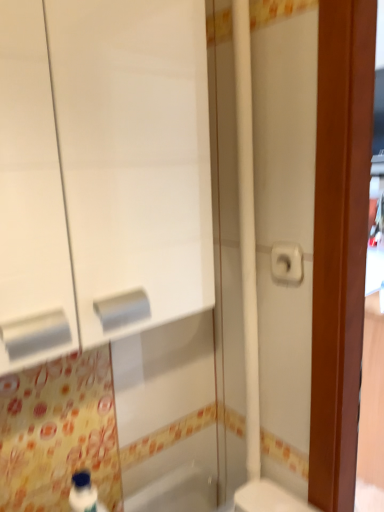
Question: Does white matte cabinet at left have a lesser width compared to white matte toilet paper at right?

Choices:
 (A) no
 (B) yes

Answer: (A)

Question: Is white matte cabinet at left surrounding white matte toilet paper at right?

Choices:
 (A) yes
 (B) no

Answer: (B)

Question: From the image's perspective, is white matte cabinet at left over white matte toilet paper at right?

Choices:
 (A) yes
 (B) no

Answer: (A)

Question: Considering the relative sizes of white matte cabinet at left and white matte toilet paper at right in the image provided, is white matte cabinet at left bigger than white matte toilet paper at right?

Choices:
 (A) yes
 (B) no

Answer: (A)

Question: Would you consider white matte cabinet at left to be distant from white matte toilet paper at right?

Choices:
 (A) no
 (B) yes

Answer: (A)

Question: Is white glossy toilet at lower right to the left or to the right of white matte toilet paper at right in the image?

Choices:
 (A) right
 (B) left

Answer: (A)

Question: Is white glossy toilet at lower right bigger or smaller than white matte toilet paper at right?

Choices:
 (A) small
 (B) big

Answer: (B)

Question: Considering the positions of white glossy toilet at lower right and white matte toilet paper at right in the image, is white glossy toilet at lower right taller or shorter than white matte toilet paper at right?

Choices:
 (A) short
 (B) tall

Answer: (B)

Question: In terms of width, does white glossy toilet at lower right look wider or thinner when compared to white matte toilet paper at right?

Choices:
 (A) thin
 (B) wide

Answer: (B)

Question: Considering the positions of white matte cabinet at left and white glossy toilet at lower right in the image, is white matte cabinet at left taller or shorter than white glossy toilet at lower right?

Choices:
 (A) short
 (B) tall

Answer: (B)

Question: Is white matte cabinet at left bigger or smaller than white glossy toilet at lower right?

Choices:
 (A) big
 (B) small

Answer: (A)

Question: Do you think white matte cabinet at left is within white glossy toilet at lower right, or outside of it?

Choices:
 (A) inside
 (B) outside

Answer: (B)

Question: Considering their positions, is white matte cabinet at left located in front of or behind white glossy toilet at lower right?

Choices:
 (A) behind
 (B) front

Answer: (B)

Question: Does point (274, 272) appear closer or farther from the camera than point (200, 22)?

Choices:
 (A) closer
 (B) farther

Answer: (B)

Question: Is white matte toilet paper at right to the left or to the right of white matte cabinet at left in the image?

Choices:
 (A) left
 (B) right

Answer: (B)